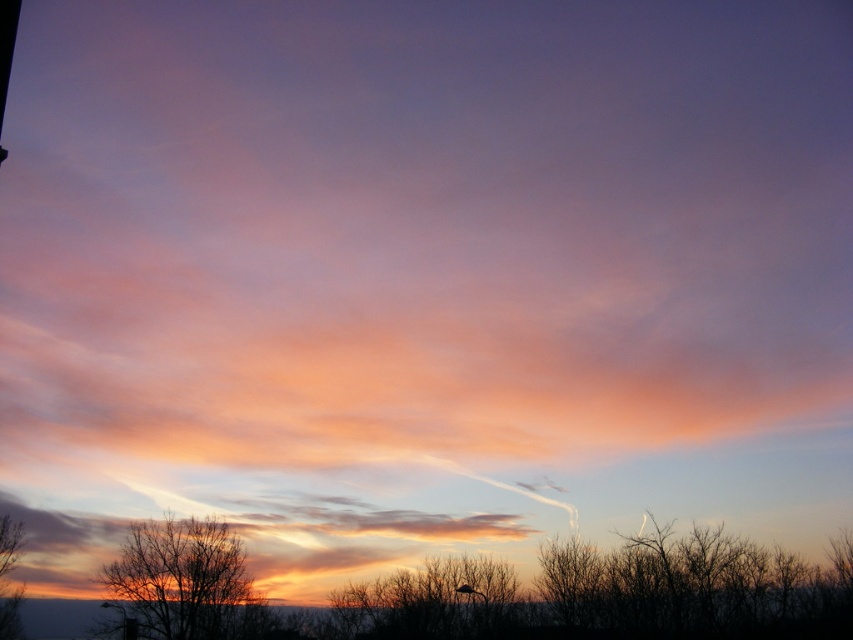
You are an astronomer observing the sunset scene. You notice two points in the sky, one at point (68, 497) and the other at point (161, 630). Based on their positions, which point is closer to the horizon?

Point (161, 630) is closer to the horizon because it is in front of point (68, 497).

From the picture: You are an artist trying to paint the sunset scene. You need to decide the vertical positioning of the translucent white cloud at center and the silhouette bare tree at lower left. Based on the scene, which object should be placed higher in your painting?

The translucent white cloud at center should be placed higher in the painting because it is taller than the silhouette bare tree at lower left.

You are an artist trying to paint the sunset scene. You want to ensure the translucent white cloud at center and the brown matte tree at lower left are positioned correctly according to their depth. Which object should you paint first to create the illusion of depth?

You should paint the translucent white cloud at center first because it is closer to the viewer than the brown matte tree at lower left, so painting it over the tree will create the correct depth perception.